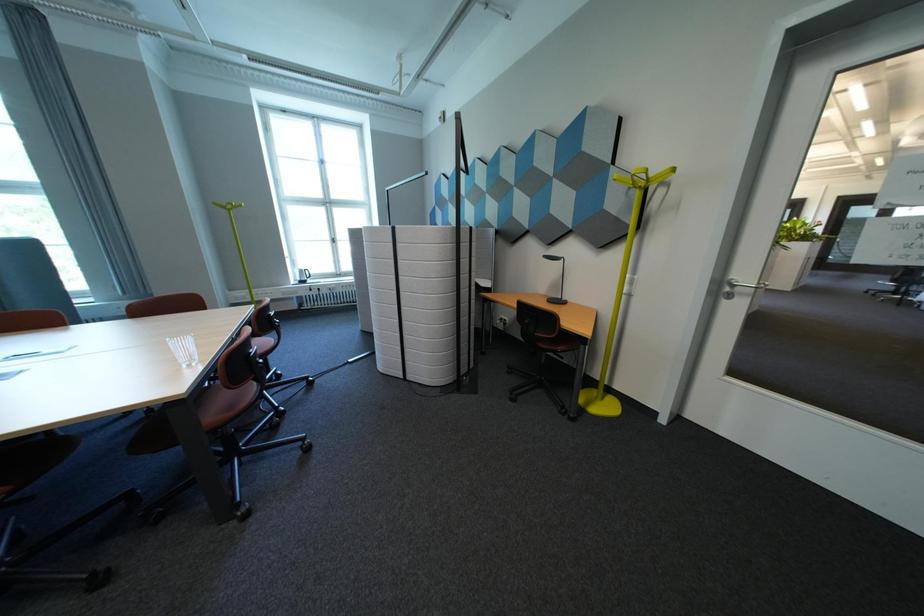
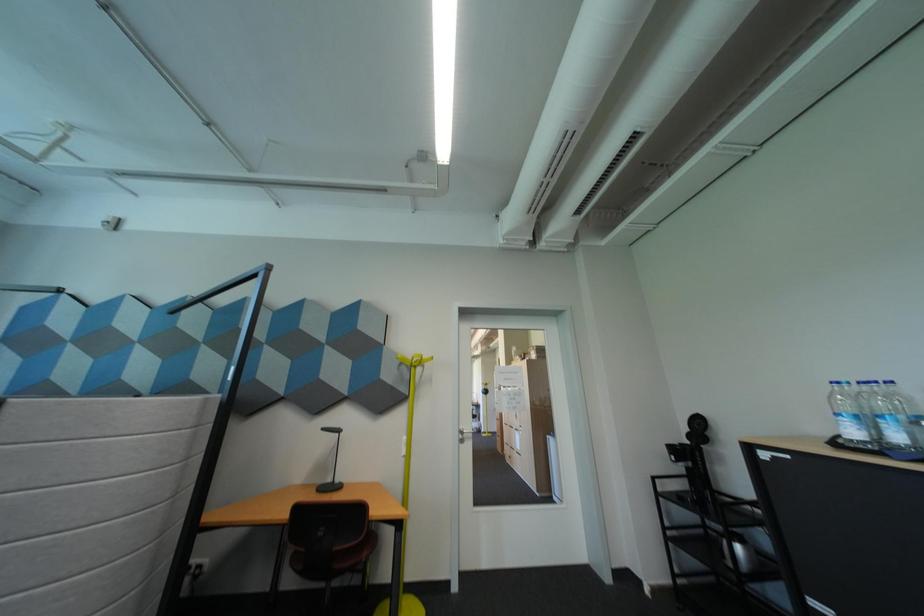
First-person continuous shooting, in which direction is the camera rotating?

The camera rotated toward right-up.